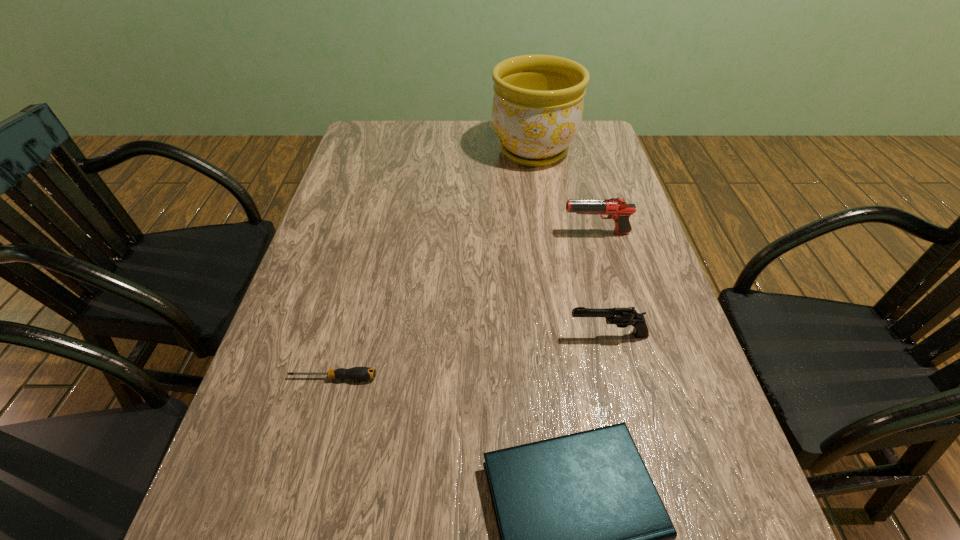
In order to click on the farthest object in this screenshot , I will do `click(537, 109)`.

Identify the location of the tallest object. Image resolution: width=960 pixels, height=540 pixels. (537, 109).

This screenshot has width=960, height=540. I want to click on the farther gun, so click(618, 209).

I want to click on the taller gun, so tap(618, 209).

You are a GUI agent. You are given a task and a screenshot of the screen. Output one action in this format:
    pyautogui.click(x=<x>, y=<y>)
    Task: Click on the nearer gun
    
    Given the screenshot: What is the action you would take?
    pyautogui.click(x=622, y=317)

Locate an element on the screen. Image resolution: width=960 pixels, height=540 pixels. the third nearest object is located at coordinates (622, 317).

Where is `the leftmost object`? the leftmost object is located at coordinates (356, 373).

Find the location of a particular element. The image size is (960, 540). screwdriver is located at coordinates (356, 373).

The width and height of the screenshot is (960, 540). Identify the location of vacant space positioned 0.400m on the front of the flowerpot. (552, 269).

Locate an element on the screen. Image resolution: width=960 pixels, height=540 pixels. free space located at the aiming end of the second tallest object is located at coordinates (431, 233).